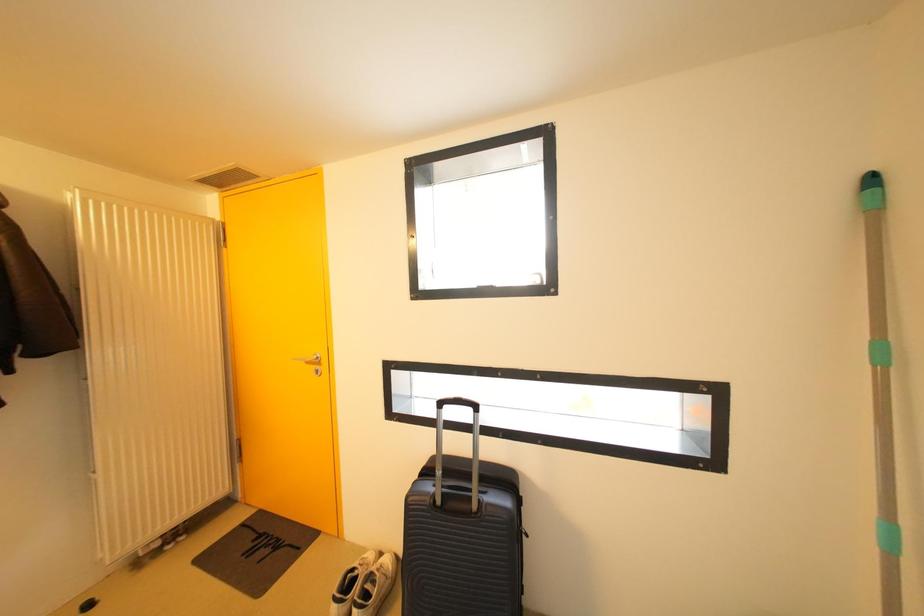
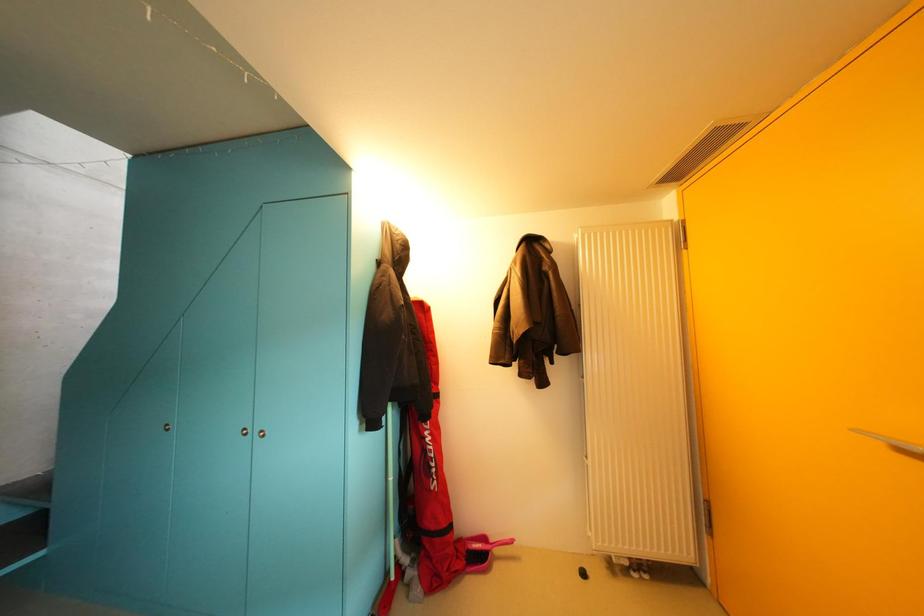
Question: The first image is from the beginning of the video and the second image is from the end. How did the camera likely rotate when shooting the video?

Choices:
 (A) Left
 (B) Right
 (C) Up
 (D) Down

Answer: (A)